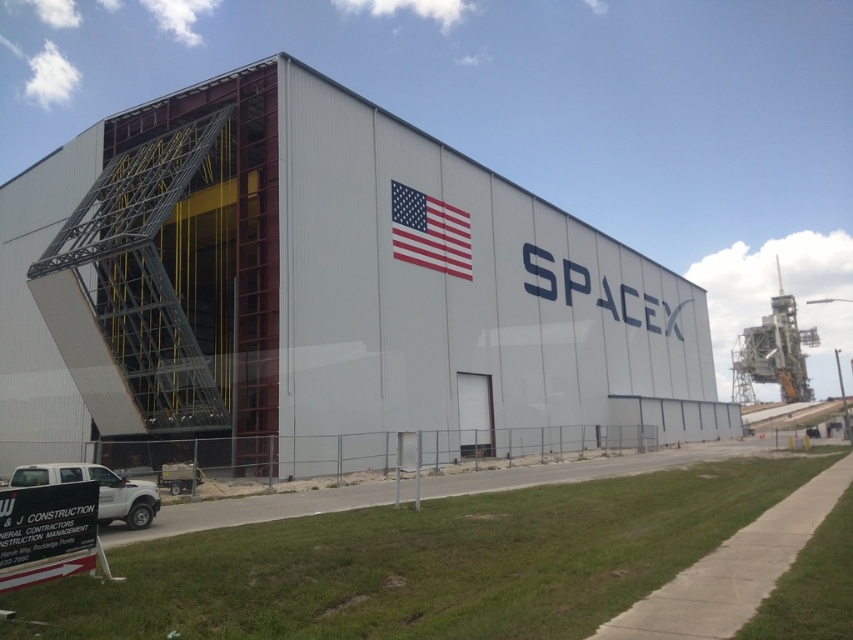
You are a delivery driver arriving at the SpaceX facility. You see the american flag at center and the white matte truck at lower left. Which object is higher from the ground?

The american flag at center is above the white matte truck at lower left, so the american flag at center is higher from the ground.

You are a delivery driver arriving at the SpaceX facility. You need to park your truck in the area closest to the white matte hangar at center and the american flag at center. Which object should you park closer to if you want to be nearer to the hangar?

The white matte hangar at center is bigger than the american flag at center. To park closer to the hangar, you should position your truck near the white matte hangar at center since it occupies a larger area, making it easier to approach and park adjacent to it.

You are planning to move the white matte truck at lower left into the white matte hangar at center. Based on their sizes, is this feasible?

The white matte hangar at center might be wider than the white matte truck at lower left, so it is possible that the truck can fit inside the hangar. However, the exact dimensions are uncertain due to the description using the word